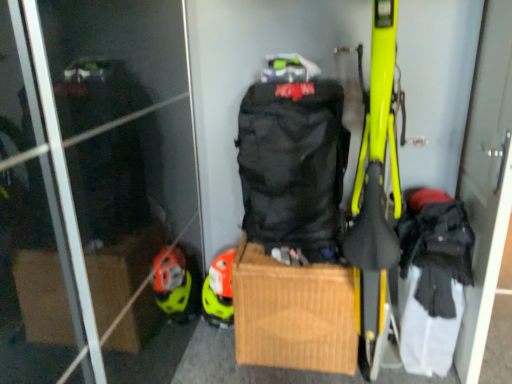
In order to face black matte backpack at center, should I rotate leftwards or rightwards?

To align with it, rotate right about 4.959°.

The height and width of the screenshot is (384, 512). I want to click on brown cardboard box at center, so click(293, 313).

This screenshot has width=512, height=384. In order to click on black matte backpack at center in this screenshot , I will do `click(293, 166)`.

Looking at this image, from the image's perspective, is brown cardboard box at center above or below black fabric backpack at right?

Clearly, from the image's perspective, brown cardboard box at center is below black fabric backpack at right.

Locate an element on the screen. Image resolution: width=512 pixels, height=384 pixels. cardboard box that is on the left side of black fabric backpack at right is located at coordinates (293, 313).

Considering the sizes of objects brown cardboard box at center and black fabric backpack at right in the image provided, who is thinner, brown cardboard box at center or black fabric backpack at right?

Thinner between the two is black fabric backpack at right.

How distant is brown cardboard box at center from black fabric backpack at right?

A distance of 28.02 inches exists between brown cardboard box at center and black fabric backpack at right.

Considering their positions, is orange matte helmet at center located in front of or behind brown cardboard box at center?

Visually, orange matte helmet at center is located behind brown cardboard box at center.

Looking at this image, from the image's perspective, between orange matte helmet at center and brown cardboard box at center, which one is located above?

From the image's view, orange matte helmet at center is above.

Can you tell me how much orange matte helmet at center and brown cardboard box at center differ in facing direction?

The angle between the facing direction of orange matte helmet at center and the facing direction of brown cardboard box at center is 0.874 degrees.

Can you confirm if orange matte helmet at center is taller than brown cardboard box at center?

No.

Considering the sizes of objects black matte backpack at center and orange matte helmet at center in the image provided, who is shorter, black matte backpack at center or orange matte helmet at center?

orange matte helmet at center is shorter.

From the image's perspective, is black matte backpack at center located above or below orange matte helmet at center?

Based on their image positions, black matte backpack at center is located above orange matte helmet at center.

In order to click on helmet located below the black matte backpack at center (from the image's perspective) in this screenshot , I will do `click(219, 291)`.

Is orange matte helmet at center inside black matte backpack at center?

No, orange matte helmet at center is not a part of black matte backpack at center.

Is black matte backpack at center positioned beyond the bounds of brown cardboard box at center?

black matte backpack at center is positioned outside brown cardboard box at center.

Based on the photo, measure the distance from black matte backpack at center to brown cardboard box at center.

black matte backpack at center and brown cardboard box at center are 32.31 centimeters apart.

Is black matte backpack at center closer to camera compared to brown cardboard box at center?

Yes, black matte backpack at center is closer to the camera.

How many degrees apart are the facing directions of black matte backpack at center and brown cardboard box at center?

1.06 degrees separate the facing orientations of black matte backpack at center and brown cardboard box at center.

From the image's perspective, is orange matte helmet at center positioned above or below black matte backpack at center?

→ orange matte helmet at center is below black matte backpack at center.

Is orange matte helmet at center bigger than black matte backpack at center?

No, orange matte helmet at center is not bigger than black matte backpack at center.

Measure the distance from orange matte helmet at center to black matte backpack at center.

orange matte helmet at center is 48.99 centimeters from black matte backpack at center.

Which is in front, point (480, 200) or point (214, 300)?

The point (480, 200) is in front.

Is black fabric backpack at right completely or partially outside of orange matte helmet at center?

That's correct, black fabric backpack at right is outside of orange matte helmet at center.

From a real-world perspective, is black fabric backpack at right under orange matte helmet at center?

No, from a real-world perspective, black fabric backpack at right is not below orange matte helmet at center.

Is black fabric backpack at right turned away from black matte backpack at center?

Yes, black fabric backpack at right is facing away from black matte backpack at center.

Between point (475, 102) and point (306, 174), which one is positioned in front?

The point (306, 174) is closer.

Consider the image. Can you confirm if black fabric backpack at right is positioned to the left of black matte backpack at center?

Incorrect, black fabric backpack at right is not on the left side of black matte backpack at center.

Is black fabric backpack at right located outside black matte backpack at center?

Absolutely, black fabric backpack at right is external to black matte backpack at center.

In the image, there is a brown cardboard box at center. Identify the location of screen door above it (from the image's perspective). This screenshot has width=512, height=384. (486, 179).

Where is `cardboard box lying on the right of orange matte helmet at center`? This screenshot has width=512, height=384. cardboard box lying on the right of orange matte helmet at center is located at coordinates (293, 313).

Considering their positions, is black matte backpack at center positioned further to brown cardboard box at center than black fabric backpack at right?

black fabric backpack at right is positioned further to the anchor brown cardboard box at center.

From the image, which object appears to be farther from orange matte helmet at center, black matte backpack at center or black fabric backpack at right?

black fabric backpack at right lies further to orange matte helmet at center than the other object.

Based on their spatial positions, is black fabric backpack at right or black matte backpack at center closer to brown cardboard box at center?

black matte backpack at center lies closer to brown cardboard box at center than the other object.

Which object lies nearer to the anchor point brown cardboard box at center, orange matte helmet at center or black fabric backpack at right?

Among the two, orange matte helmet at center is located nearer to brown cardboard box at center.

Estimate the real-world distances between objects in this image. Which object is closer to black fabric backpack at right, brown cardboard box at center or orange matte helmet at center?

Based on the image, brown cardboard box at center appears to be nearer to black fabric backpack at right.

From the image, which object appears to be farther from orange matte helmet at center, black fabric backpack at right or brown cardboard box at center?

Among the two, black fabric backpack at right is located further to orange matte helmet at center.

When comparing their distances from black matte backpack at center, does orange matte helmet at center or black fabric backpack at right seem further?

Based on the image, black fabric backpack at right appears to be further to black matte backpack at center.

Considering their positions, is brown cardboard box at center positioned further to black matte backpack at center than orange matte helmet at center?

orange matte helmet at center is positioned further to the anchor black matte backpack at center.

Locate an element on the screen. backpack situated between orange matte helmet at center and black fabric backpack at right from left to right is located at coordinates (293, 166).

Identify the location of cardboard box situated between orange matte helmet at center and black fabric backpack at right from left to right. The height and width of the screenshot is (384, 512). (293, 313).

The height and width of the screenshot is (384, 512). Identify the location of cardboard box between black matte backpack at center and black fabric backpack at right from left to right. (293, 313).

Locate an element on the screen. Image resolution: width=512 pixels, height=384 pixels. helmet that lies between black matte backpack at center and brown cardboard box at center from top to bottom is located at coordinates (219, 291).